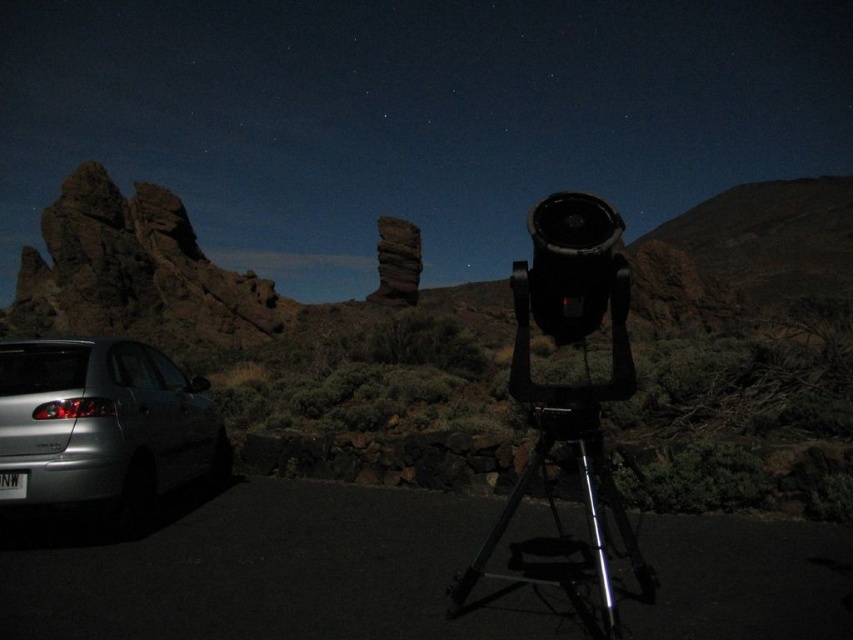
In the scene shown: You are an astronomer setting up equipment in this desert location. You have a 2.5 meter wide telescope cover that you need to store. The dark brown rocky outcrop at left and the silver metallic tripod at center are both potential storage spots. Which object can the telescope cover fit over without overlapping its edges?

The dark brown rocky outcrop at left might be wider than the silver metallic tripod at center, so the telescope cover can fit over the dark brown rocky outcrop at left since it is wider than the tripod.

You are an astronomer setting up equipment for a star observation. You have a silver metallic car at lower left and a silver metallic tripod at center. Which object is smaller in size?

The silver metallic car at lower left is smaller in size compared to the silver metallic tripod at center.

You are an astronomer setting up equipment in the desert. You have a silver metallic car at lower left and a silver metallic tripod at center. Which object is taller?

The silver metallic tripod at center is taller than the silver metallic car at lower left.